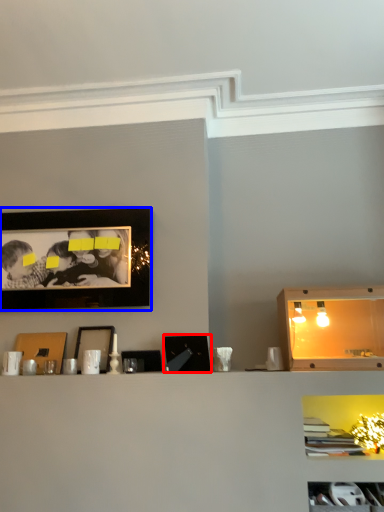
Question: Among these objects, which one is nearest to the camera, picture frame (highlighted by a red box) or picture frame (highlighted by a blue box)?

Choices:
 (A) picture frame
 (B) picture frame

Answer: (A)